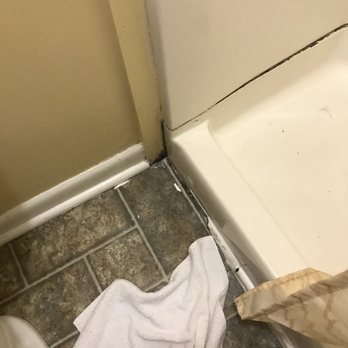
The image size is (348, 348). What are the coordinates of `damaged grout around shower` in the screenshot? It's located at (246, 282).